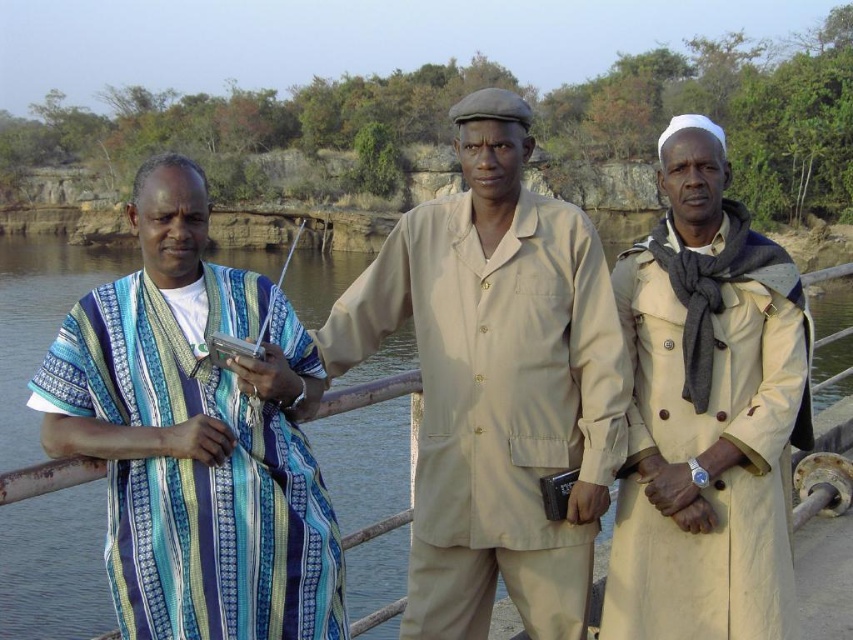
Question: Does blue striped fabric at left have a greater width compared to beige cotton trench coat at right?

Choices:
 (A) no
 (B) yes

Answer: (B)

Question: Does beige fabric suit at center have a lesser width compared to beige cotton trench coat at right?

Choices:
 (A) yes
 (B) no

Answer: (B)

Question: Among these objects, which one is farthest from the camera?

Choices:
 (A) blue striped fabric at left
 (B) beige fabric suit at center
 (C) beige cotton trench coat at right

Answer: (B)

Question: Which point appears closest to the camera in this image?

Choices:
 (A) (695, 547)
 (B) (550, 364)

Answer: (A)

Question: Which is farther from the blue striped fabric at left?

Choices:
 (A) beige fabric suit at center
 (B) beige cotton trench coat at right

Answer: (B)

Question: Does blue striped fabric at left have a larger size compared to beige cotton trench coat at right?

Choices:
 (A) no
 (B) yes

Answer: (B)